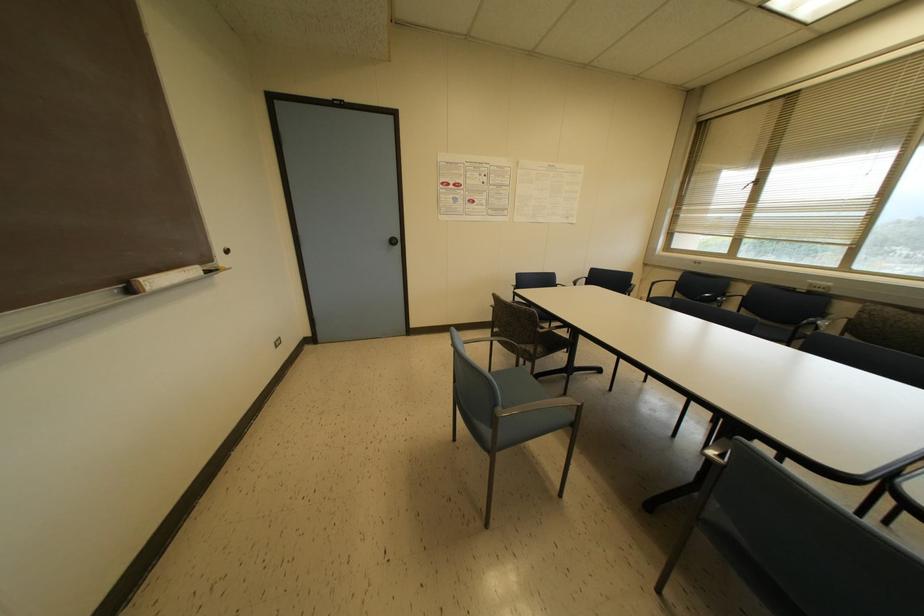
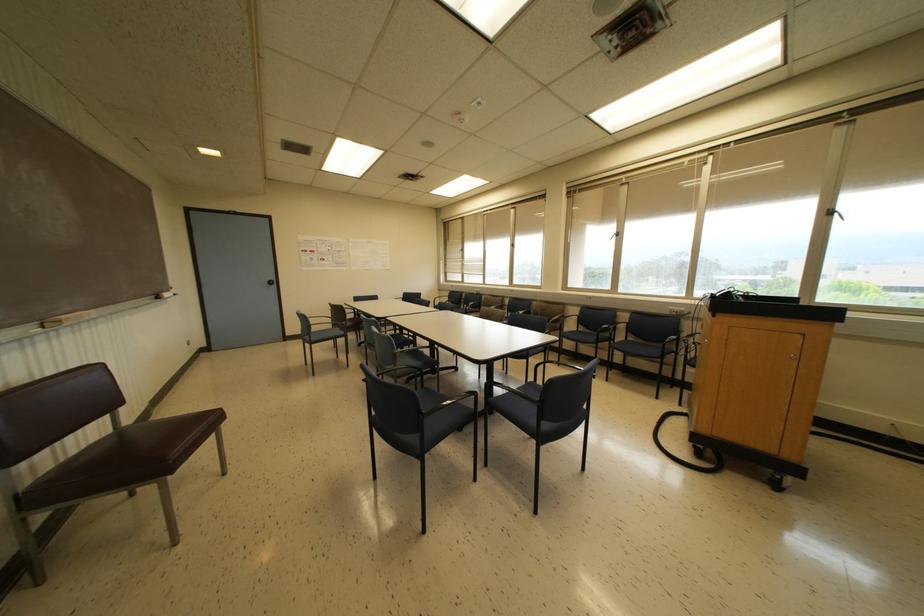
Question: I am providing you with two images of the same scene from different viewpoints. After the viewpoint changes to image2, which objects are now occluded?

Choices:
 (A) black door knob
 (B) blue chair armrest
 (C) chalkboard eraser
 (D) none of these

Answer: (D)